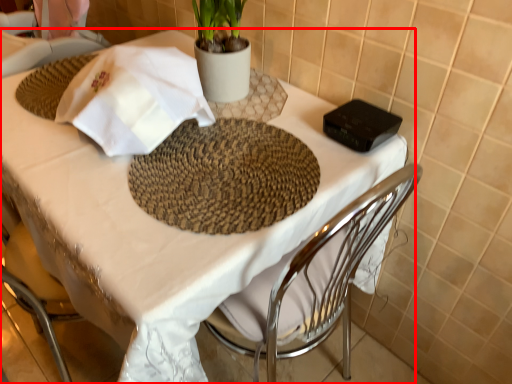
Question: From the image, what is the correct spatial relationship of table (annotated by the red box) in relation to cloth?

Choices:
 (A) left
 (B) right

Answer: (B)